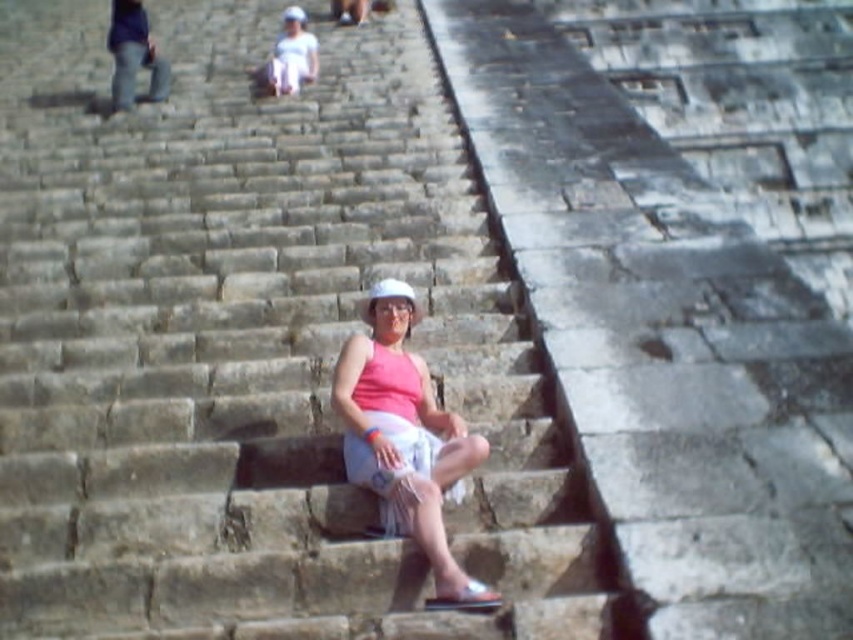
Which is more to the right, stone stairs at center or pink fabric at center?

pink fabric at center

Who is taller, stone stairs at center or pink fabric at center?

stone stairs at center

Who is more distant from viewer, (282, 486) or (393, 499)?

The point (282, 486) is behind.

Where is `stone stairs at center`? The width and height of the screenshot is (853, 640). stone stairs at center is located at coordinates (251, 346).